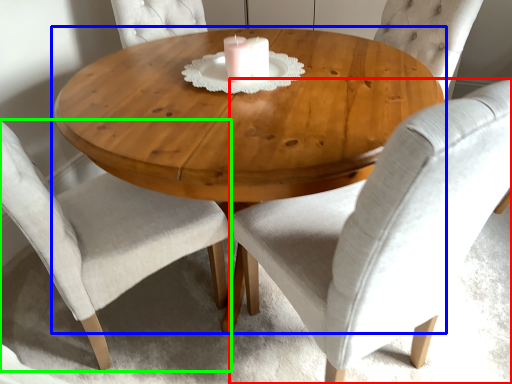
Question: Which object is the farthest from chair (highlighted by a red box)? Choose among these: coffee table (highlighted by a blue box) or chair (highlighted by a green box).

Choices:
 (A) coffee table
 (B) chair

Answer: (B)